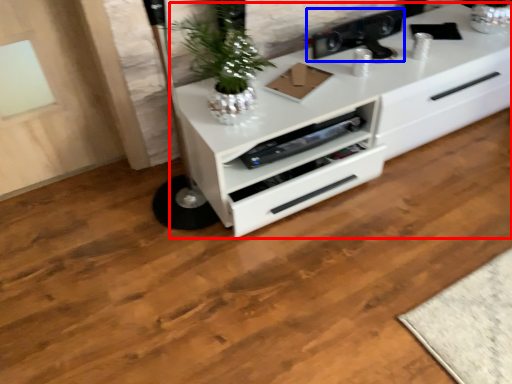
Question: Among these objects, which one is nearest to the camera, chest of drawers (highlighted by a red box) or appliance (highlighted by a blue box)?

Choices:
 (A) chest of drawers
 (B) appliance

Answer: (A)